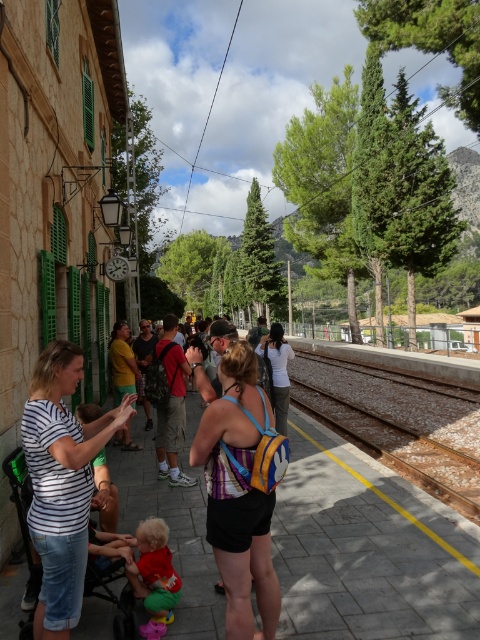
Can you confirm if striped cotton shirt at center is shorter than red-clothed backpack at center?

Yes.

Does striped cotton shirt at center have a smaller size compared to red-clothed backpack at center?

Yes.

Find the location of a particular element. This screenshot has height=640, width=480. striped cotton shirt at center is located at coordinates click(61, 483).

Who is more distant from viewer, (268, 508) or (142, 337)?

The point (142, 337) is more distant.

I want to click on multicolored fabric backpack at center, so click(x=239, y=496).

Is point (454, 502) farther from viewer compared to point (286, 433)?

No, it is in front of (286, 433).

From the picture: Does smooth concrete train track at center lie in front of white cotton shirt at center?

No, it is not.

At what (x,y) coordinates should I click in order to perform the action: click on smooth concrete train track at center. Please return your answer as a coordinate pair (x, y). Image resolution: width=480 pixels, height=640 pixels. Looking at the image, I should click on (391, 424).

Image resolution: width=480 pixels, height=640 pixels. What are the coordinates of `smooth concrete train track at center` in the screenshot? It's located at (391, 424).